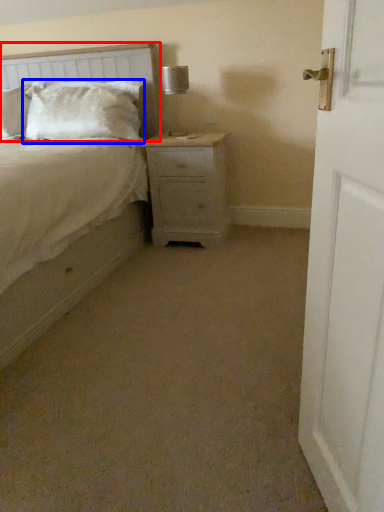
Question: Which point is closer to the camera, headboard (highlighted by a red box) or pillow (highlighted by a blue box)?

Choices:
 (A) headboard
 (B) pillow

Answer: (A)